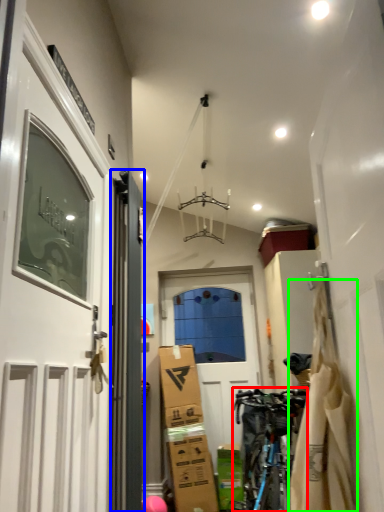
Question: Which is farther away from bicycle (highlighted by a red box)? door (highlighted by a blue box) or material (highlighted by a green box)?

Choices:
 (A) door
 (B) material

Answer: (B)